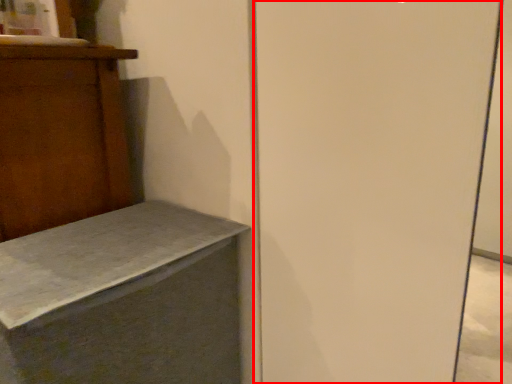
Question: From the image's perspective, considering the relative positions of screen door (annotated by the red box) and furniture in the image provided, where is screen door (annotated by the red box) located with respect to the staircase?

Choices:
 (A) above
 (B) below

Answer: (A)